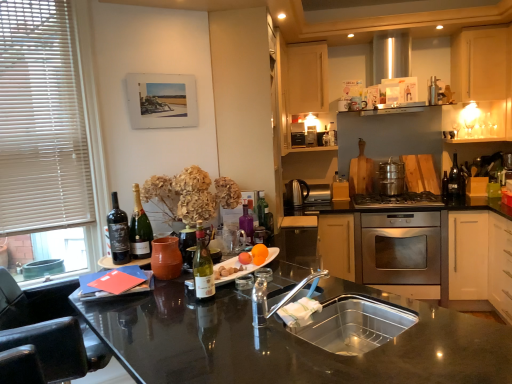
Question: In which direction should I rotate to look at satin nickel kettle at center, which is counted as the 2th appliance, starting from the right?

Choices:
 (A) left
 (B) right

Answer: (B)

Question: Is green glass bottle at center, positioned as the first bottle in right-to-left order, outside matte ceramic vase at center, the third appliance when ordered from right to left?

Choices:
 (A) no
 (B) yes

Answer: (B)

Question: Is matte ceramic vase at center, which ranks as the third appliance in back-to-front order, located within green glass bottle at center, positioned as the first bottle in right-to-left order?

Choices:
 (A) yes
 (B) no

Answer: (B)

Question: Is green glass bottle at center, which ranks as the first bottle in back-to-front order, closer to the viewer compared to matte ceramic vase at center, which ranks as the third appliance in back-to-front order?

Choices:
 (A) yes
 (B) no

Answer: (B)

Question: Does green glass bottle at center, which ranks as the first bottle in back-to-front order, appear on the left side of matte ceramic vase at center, the 1th appliance from the left?

Choices:
 (A) yes
 (B) no

Answer: (B)

Question: From the image's perspective, is green glass bottle at center, positioned as the first bottle in right-to-left order, beneath matte ceramic vase at center, which ranks as the first appliance in front-to-back order?

Choices:
 (A) no
 (B) yes

Answer: (A)

Question: Does green glass bottle at center, positioned as the first bottle in right-to-left order, lie behind matte ceramic vase at center, which ranks as the first appliance in front-to-back order?

Choices:
 (A) no
 (B) yes

Answer: (B)

Question: Are stainless steel gas stove at center and stainless steel sink at center beside each other?

Choices:
 (A) no
 (B) yes

Answer: (A)

Question: Is stainless steel gas stove at center far away from stainless steel sink at center?

Choices:
 (A) no
 (B) yes

Answer: (B)

Question: Is stainless steel gas stove at center facing away from stainless steel sink at center?

Choices:
 (A) yes
 (B) no

Answer: (B)

Question: Is stainless steel gas stove at center positioned before stainless steel sink at center?

Choices:
 (A) yes
 (B) no

Answer: (B)

Question: From a real-world perspective, is stainless steel gas stove at center located higher than stainless steel sink at center?

Choices:
 (A) no
 (B) yes

Answer: (B)

Question: From the image's perspective, is stainless steel gas stove at center over stainless steel sink at center?

Choices:
 (A) no
 (B) yes

Answer: (B)

Question: Does light wood cabinet at upper center, which is the first cabinetry from left to right, turn towards matte glass wine at left, which is counted as the second wine, starting from the right?

Choices:
 (A) yes
 (B) no

Answer: (B)